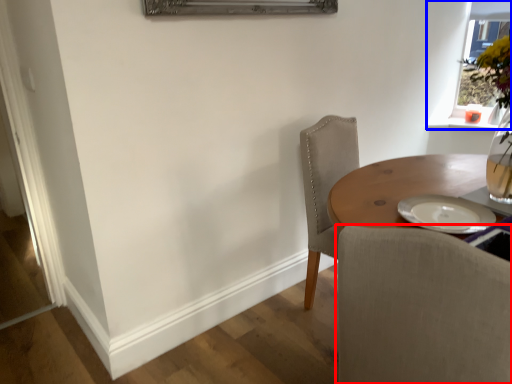
Question: Which point is further to the camera, chair (highlighted by a red box) or window (highlighted by a blue box)?

Choices:
 (A) chair
 (B) window

Answer: (B)